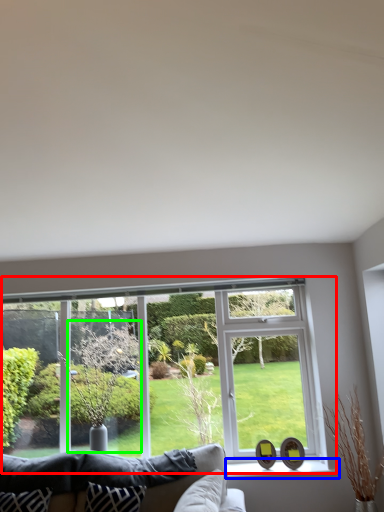
Question: Which object is the closest to the window (highlighted by a red box)? Choose among these: window sill (highlighted by a blue box) or tree (highlighted by a green box).

Choices:
 (A) window sill
 (B) tree

Answer: (B)